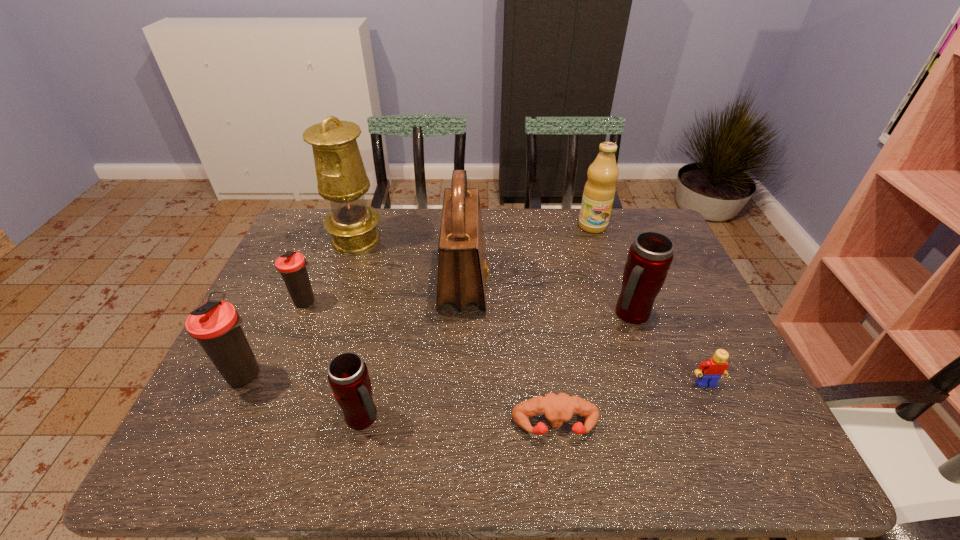
Find the location of a particular element. This screenshot has height=540, width=960. oil lamp is located at coordinates (341, 176).

Image resolution: width=960 pixels, height=540 pixels. I want to click on shoulder bag, so click(x=462, y=271).

I want to click on the fifth object from left to right, so click(462, 271).

At what (x,y) coordinates should I click in order to perform the action: click on olive oil. Please return your answer as a coordinate pair (x, y). Looking at the image, I should click on [x=599, y=191].

Where is `the right red thermos bottle`? This screenshot has height=540, width=960. the right red thermos bottle is located at coordinates (650, 256).

Locate an element on the screen. Image resolution: width=960 pixels, height=540 pixels. the rightmost thermos bottle is located at coordinates (650, 256).

At what (x,y) coordinates should I click in order to perform the action: click on the third farthest thermos bottle. Please return your answer as a coordinate pair (x, y). Looking at the image, I should click on (215, 325).

I want to click on the bigger brown thermos bottle, so click(x=215, y=325).

Where is `the smaller brown thermos bottle`? The height and width of the screenshot is (540, 960). the smaller brown thermos bottle is located at coordinates (292, 265).

Locate an element on the screen. This screenshot has height=540, width=960. the left red thermos bottle is located at coordinates (348, 376).